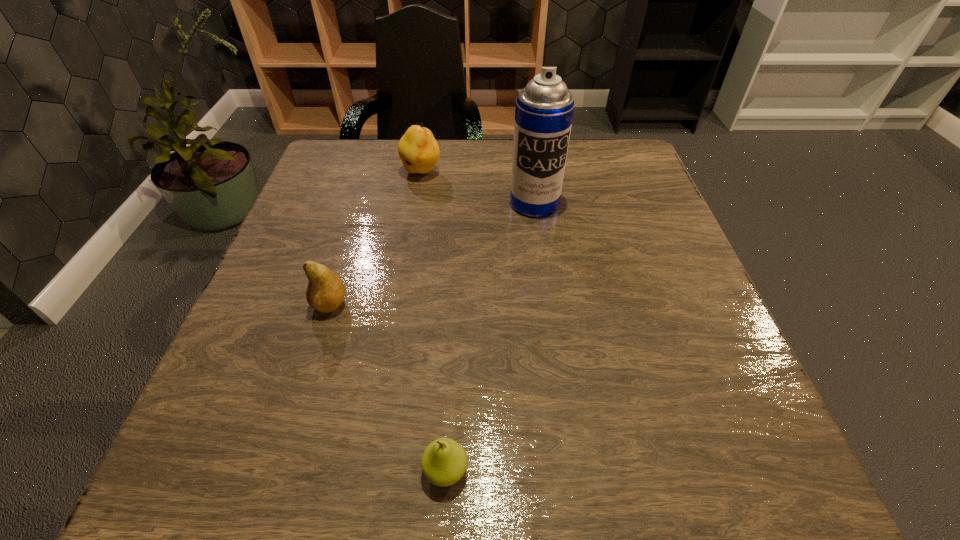
This screenshot has height=540, width=960. I want to click on the tallest object, so click(544, 109).

Where is `aerosol can`? The image size is (960, 540). aerosol can is located at coordinates (544, 109).

You are a GUI agent. You are given a task and a screenshot of the screen. Output one action in this format:
    pyautogui.click(x=<x>, y=<y>)
    Task: Click on the second pear from left to right
    
    Given the screenshot: What is the action you would take?
    pyautogui.click(x=419, y=151)

You are a GUI agent. You are given a task and a screenshot of the screen. Output one action in this format:
    pyautogui.click(x=<x>, y=<y>)
    Task: Click on the farthest object
    
    Given the screenshot: What is the action you would take?
    419,151

Locate an element on the screen. the leftmost pear is located at coordinates (325, 292).

At what (x,y) coordinates should I click in order to perform the action: click on the second farthest pear. Please return your answer as a coordinate pair (x, y). Image resolution: width=960 pixels, height=540 pixels. Looking at the image, I should click on (325, 292).

Where is `the nearest object`? The image size is (960, 540). the nearest object is located at coordinates (444, 461).

This screenshot has width=960, height=540. What are the coordinates of `the rightmost pear` in the screenshot? It's located at (444, 461).

Find the location of a particular element. This screenshot has height=540, width=960. vacant space located on the label side of the third nearest object is located at coordinates (541, 253).

At what (x,y) coordinates should I click in order to perform the action: click on free space located 0.260m on the front of the third object from right to left. Please return your answer as a coordinate pair (x, y). The width and height of the screenshot is (960, 540). Looking at the image, I should click on (407, 258).